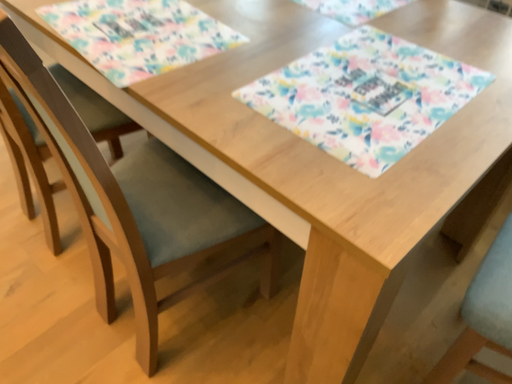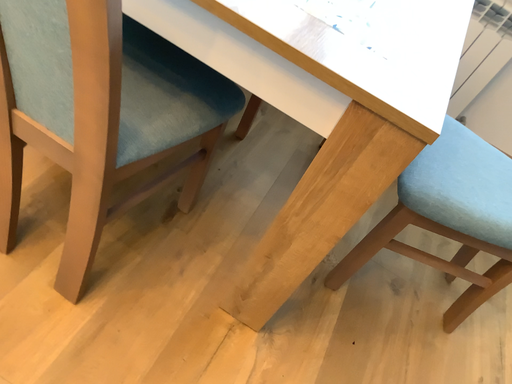
Question: How did the camera likely rotate when shooting the video?

Choices:
 (A) rotated downward
 (B) rotated upward

Answer: (A)